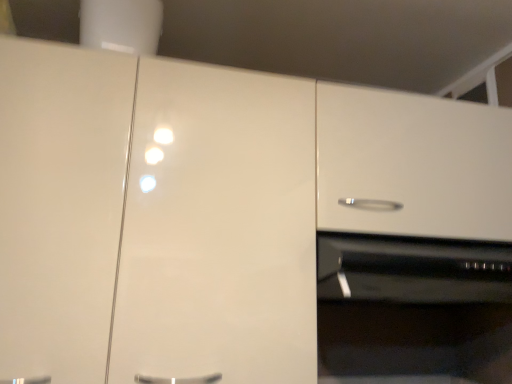
Image resolution: width=512 pixels, height=384 pixels. What do you see at coordinates (414, 307) in the screenshot?
I see `black glossy oven at lower right` at bounding box center [414, 307].

Where is `black glossy oven at lower right`? black glossy oven at lower right is located at coordinates (414, 307).

Where is `black glossy oven at lower right`? black glossy oven at lower right is located at coordinates (414, 307).